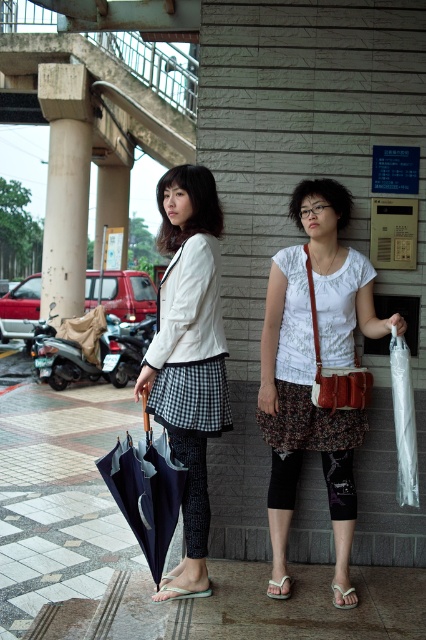
Question: Does white cotton shirt at center have a smaller size compared to matte black umbrella at left?

Choices:
 (A) yes
 (B) no

Answer: (A)

Question: Considering the real-world distances, which object is closest to the white cotton shirt at center?

Choices:
 (A) rustic felt crossbody bag at center
 (B) concrete column at center

Answer: (A)

Question: Where is matte black umbrella at left located in relation to transparent plastic bag at right in the image?

Choices:
 (A) right
 (B) left

Answer: (B)

Question: Is matte black umbrella at left smaller than dark blue fabric umbrella at lower left?

Choices:
 (A) yes
 (B) no

Answer: (B)

Question: Which is farther from the polished concrete pavement at center?

Choices:
 (A) concrete column at center
 (B) rustic felt crossbody bag at center

Answer: (A)

Question: Estimate the real-world distances between objects in this image. Which object is closer to the matte black umbrella at left?

Choices:
 (A) rustic felt crossbody bag at center
 (B) concrete column at center

Answer: (A)